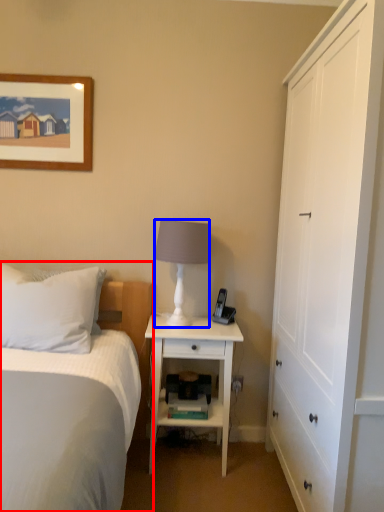
Question: Which point is further to the camera, bed (highlighted by a red box) or lamp (highlighted by a blue box)?

Choices:
 (A) bed
 (B) lamp

Answer: (B)